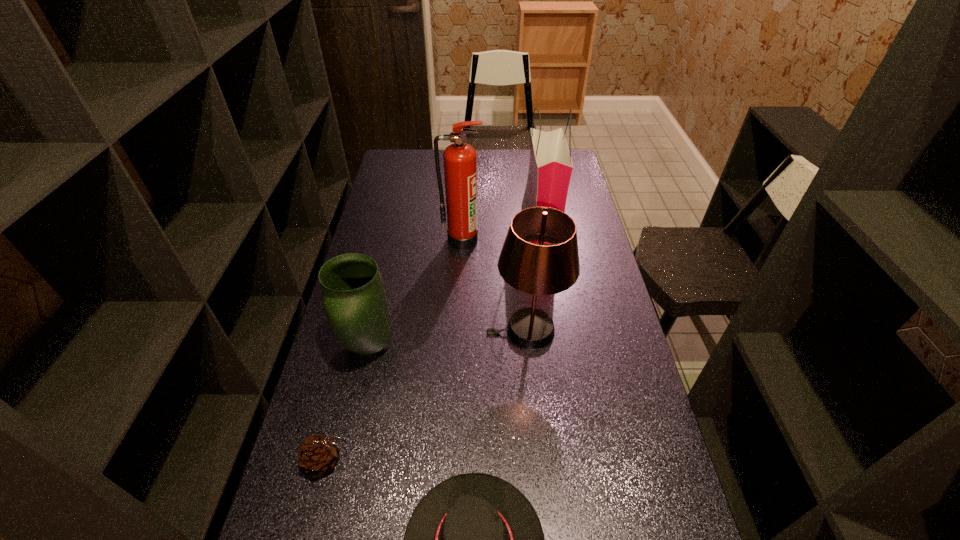
Locate an element on the screen. Image resolution: width=960 pixels, height=540 pixels. shopping bag is located at coordinates (550, 167).

Locate an element on the screen. The width and height of the screenshot is (960, 540). fire extinguisher is located at coordinates (460, 159).

You are a GUI agent. You are given a task and a screenshot of the screen. Output one action in this format:
    pyautogui.click(x=<x>, y=<y>)
    Task: Click on the lampshade
    This screenshot has height=540, width=960.
    Given the screenshot: What is the action you would take?
    pyautogui.click(x=533, y=268)

The width and height of the screenshot is (960, 540). In order to click on vase in this screenshot , I will do [x=354, y=298].

In order to click on pinecone in this screenshot , I will do `click(318, 455)`.

Locate an element on the screen. This screenshot has width=960, height=540. vacant area located on the front-facing side of the shopping bag is located at coordinates (476, 226).

Identify the location of vacant space situated 0.140m on the front-facing side of the shopping bag. The width and height of the screenshot is (960, 540). (489, 226).

The width and height of the screenshot is (960, 540). What are the coordinates of `vacant space located 0.080m on the front-facing side of the shopping bag` in the screenshot? It's located at (504, 226).

At what (x,y) coordinates should I click in order to perform the action: click on free space located with the nozzle pointing from the back of the fire extinguisher. Please return your answer as a coordinate pair (x, y). This screenshot has width=960, height=540. Looking at the image, I should click on (458, 321).

Locate an element on the screen. The width and height of the screenshot is (960, 540). free space located on the front-facing side of the lampshade is located at coordinates (439, 330).